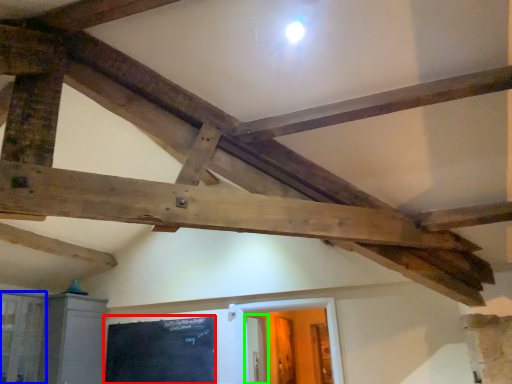
Question: Which object is the farthest from bulletin board (highlighted by a red box)? Choose among these: window (highlighted by a blue box) or door (highlighted by a green box).

Choices:
 (A) window
 (B) door

Answer: (B)